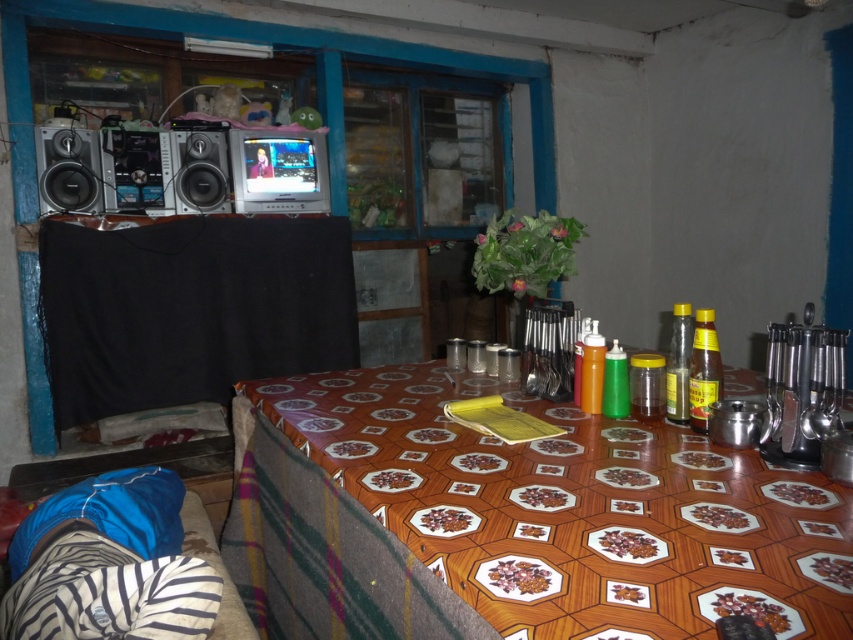
Question: Among these objects, which one is nearest to the camera?

Choices:
 (A) wooden table at center
 (B) matte black speaker at left
 (C) satin silver speaker at upper left
 (D) black fabric at left

Answer: (A)

Question: Estimate the real-world distances between objects in this image. Which object is farther from the wooden table at center?

Choices:
 (A) black fabric at left
 (B) satin silver speaker at upper left
 (C) matte black speaker at left

Answer: (C)

Question: Can you confirm if wooden table at center is positioned above matte black speaker at left?

Choices:
 (A) no
 (B) yes

Answer: (A)

Question: Where is matte black speaker at left located in relation to satin silver speaker at upper left in the image?

Choices:
 (A) above
 (B) below

Answer: (B)

Question: Which of the following is the closest to the observer?

Choices:
 (A) pos(216,157)
 (B) pos(514,609)

Answer: (B)

Question: Can you confirm if wooden table at center is positioned to the left of matte black speaker at left?

Choices:
 (A) yes
 (B) no

Answer: (B)